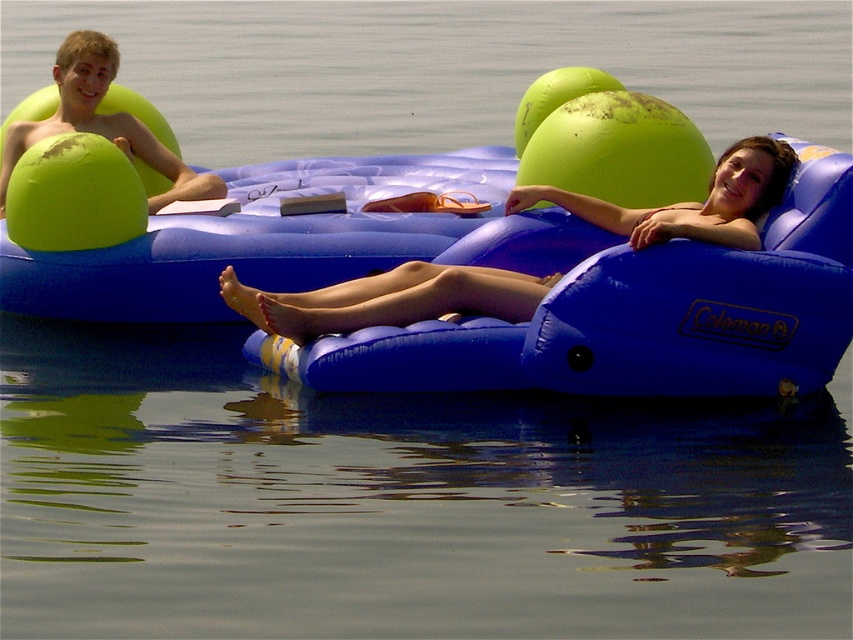
Question: Is matte blue inflatable chair at center closer to camera compared to matte green ball at upper left?

Choices:
 (A) no
 (B) yes

Answer: (B)

Question: Which point is closer to the camera taking this photo?

Choices:
 (A) (79, 129)
 (B) (508, 269)
 (C) (252, 58)

Answer: (B)

Question: Which point is closer to the camera?

Choices:
 (A) green rubber ball at upper center
 (B) matte blue inflatable chair at center
 (C) matte green ball at upper left

Answer: (B)

Question: Can you confirm if green rubber ball at upper center is wider than matte blue inflatable chair at center?

Choices:
 (A) no
 (B) yes

Answer: (B)

Question: Does green rubber ball at upper center appear on the left side of matte green ball at upper left?

Choices:
 (A) no
 (B) yes

Answer: (A)

Question: Among these points, which one is nearest to the camera?

Choices:
 (A) (596, 216)
 (B) (102, 54)

Answer: (A)